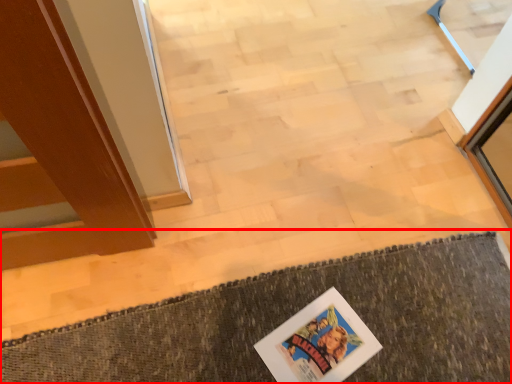
Question: Observing the image, what is the correct spatial positioning of bath mat (annotated by the red box) in reference to comic book?

Choices:
 (A) right
 (B) left

Answer: (B)